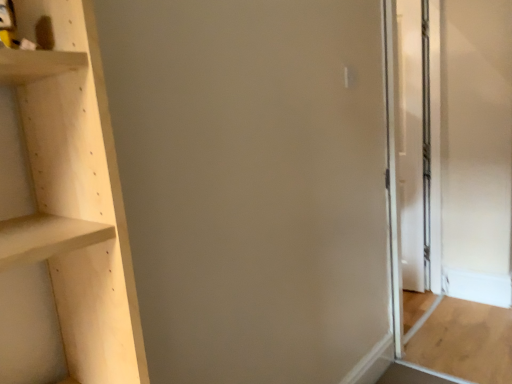
Question: Is light brown wood door at right in front of or behind transparent glass screen door at right in the image?

Choices:
 (A) behind
 (B) front

Answer: (B)

Question: In the image, is light brown wood door at right on the left side or the right side of transparent glass screen door at right?

Choices:
 (A) left
 (B) right

Answer: (B)

Question: From the image's perspective, is light brown wood door at right positioned above or below transparent glass screen door at right?

Choices:
 (A) below
 (B) above

Answer: (A)

Question: Is transparent glass screen door at right inside or outside of light brown wood door at right?

Choices:
 (A) inside
 (B) outside

Answer: (B)

Question: Considering their positions, is transparent glass screen door at right located in front of or behind light brown wood door at right?

Choices:
 (A) behind
 (B) front

Answer: (A)

Question: Considering the positions of transparent glass screen door at right and light brown wood door at right in the image, is transparent glass screen door at right bigger or smaller than light brown wood door at right?

Choices:
 (A) big
 (B) small

Answer: (A)

Question: From the image's perspective, relative to light brown wood door at right, is transparent glass screen door at right above or below?

Choices:
 (A) above
 (B) below

Answer: (A)